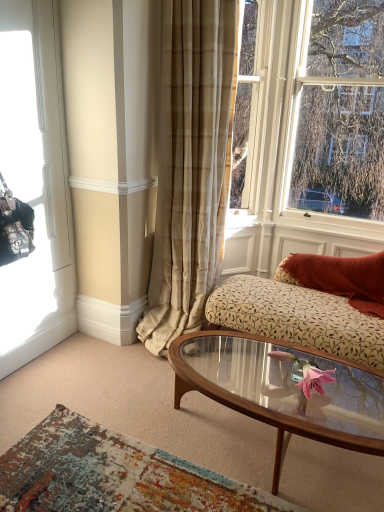
Question: From the image's perspective, is pink glass flower at center located beneath wooden glass coffee table at center?

Choices:
 (A) no
 (B) yes

Answer: (A)

Question: From a real-world perspective, is pink glass flower at center below wooden glass coffee table at center?

Choices:
 (A) no
 (B) yes

Answer: (A)

Question: Does pink glass flower at center appear on the right side of wooden glass coffee table at center?

Choices:
 (A) no
 (B) yes

Answer: (B)

Question: Considering the relative positions of pink glass flower at center and wooden glass coffee table at center in the image provided, is pink glass flower at center to the left of wooden glass coffee table at center from the viewer's perspective?

Choices:
 (A) no
 (B) yes

Answer: (A)

Question: Is pink glass flower at center not near wooden glass coffee table at center?

Choices:
 (A) no
 (B) yes

Answer: (A)

Question: Is pink glass flower at center behind wooden glass coffee table at center?

Choices:
 (A) no
 (B) yes

Answer: (B)

Question: Can you confirm if distressed rug at lower left is thinner than black leather handbag at left, positioned as the 1th window in left-to-right order?

Choices:
 (A) no
 (B) yes

Answer: (A)

Question: Can we say distressed rug at lower left lies outside black leather handbag at left, the second window when ordered from right to left?

Choices:
 (A) no
 (B) yes

Answer: (B)

Question: Is the position of distressed rug at lower left more distant than that of black leather handbag at left, the second window when ordered from right to left?

Choices:
 (A) no
 (B) yes

Answer: (A)

Question: From a real-world perspective, is distressed rug at lower left over black leather handbag at left, the second window when ordered from right to left?

Choices:
 (A) yes
 (B) no

Answer: (B)

Question: Can you confirm if distressed rug at lower left is taller than black leather handbag at left, the second window when ordered from right to left?

Choices:
 (A) no
 (B) yes

Answer: (A)

Question: Is distressed rug at lower left touching black leather handbag at left, the second window when ordered from right to left?

Choices:
 (A) yes
 (B) no

Answer: (B)

Question: From the image's perspective, is wooden glass coffee table at center on distressed rug at lower left?

Choices:
 (A) yes
 (B) no

Answer: (A)